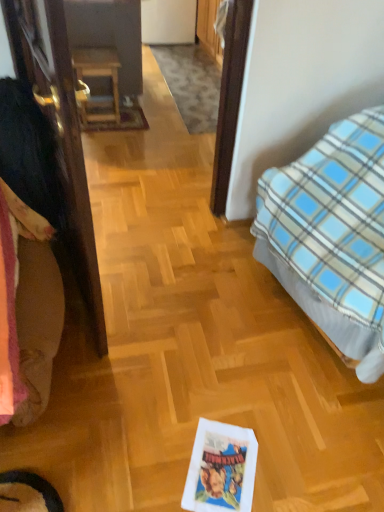
Question: From the image's perspective, is wooden table at center above fluffy beige blanket at left?

Choices:
 (A) yes
 (B) no

Answer: (A)

Question: Is wooden table at center oriented away from fluffy beige blanket at left?

Choices:
 (A) yes
 (B) no

Answer: (B)

Question: Is wooden table at center to the right of fluffy beige blanket at left from the viewer's perspective?

Choices:
 (A) yes
 (B) no

Answer: (B)

Question: Is wooden table at center further to the viewer compared to fluffy beige blanket at left?

Choices:
 (A) no
 (B) yes

Answer: (B)

Question: Is fluffy beige blanket at left completely or partially inside wooden table at center?

Choices:
 (A) yes
 (B) no

Answer: (B)

Question: Is blue plaid blanket at right inside the boundaries of fluffy beige blanket at left, or outside?

Choices:
 (A) inside
 (B) outside

Answer: (B)

Question: Based on their sizes in the image, would you say blue plaid blanket at right is bigger or smaller than fluffy beige blanket at left?

Choices:
 (A) small
 (B) big

Answer: (B)

Question: In the image, is blue plaid blanket at right positioned in front of or behind fluffy beige blanket at left?

Choices:
 (A) front
 (B) behind

Answer: (A)

Question: From their relative heights in the image, would you say blue plaid blanket at right is taller or shorter than fluffy beige blanket at left?

Choices:
 (A) short
 (B) tall

Answer: (B)

Question: Considering the positions of point (64, 33) and point (117, 61), is point (64, 33) closer or farther from the camera than point (117, 61)?

Choices:
 (A) farther
 (B) closer

Answer: (B)

Question: Considering their positions, is brown wooden door at left located in front of or behind wooden table at center?

Choices:
 (A) behind
 (B) front

Answer: (B)

Question: Looking at the image, does brown wooden door at left seem bigger or smaller compared to wooden table at center?

Choices:
 (A) small
 (B) big

Answer: (B)

Question: Is brown wooden door at left taller or shorter than wooden table at center?

Choices:
 (A) tall
 (B) short

Answer: (A)

Question: From the image's perspective, is wooden table at center above or below brown wooden door at left?

Choices:
 (A) above
 (B) below

Answer: (A)

Question: Looking at the image, does wooden table at center seem bigger or smaller compared to brown wooden door at left?

Choices:
 (A) big
 (B) small

Answer: (B)